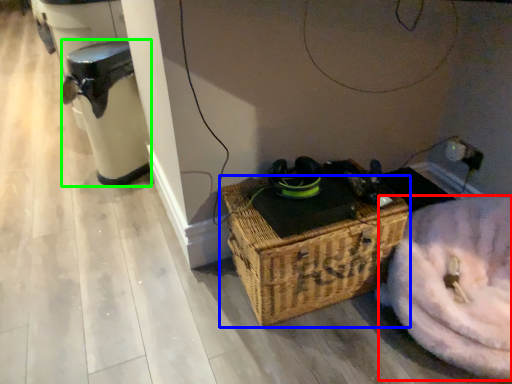
Question: Which object is the farthest from washer (highlighted by a red box)? Choose among these: picnic basket (highlighted by a blue box) or water heater (highlighted by a green box).

Choices:
 (A) picnic basket
 (B) water heater

Answer: (B)